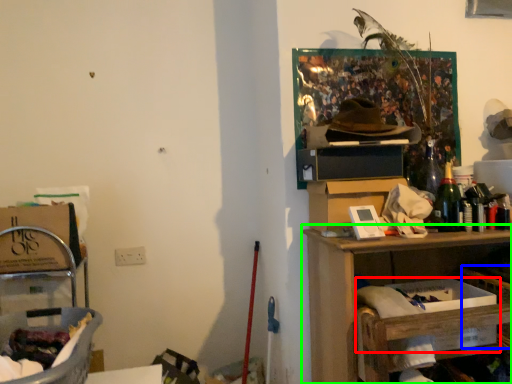
Question: Estimate the real-world distances between objects in this image. Which object is closer to box (highlighted by a red box), basket (highlighted by a blue box) or shelf (highlighted by a green box)?

Choices:
 (A) basket
 (B) shelf

Answer: (A)